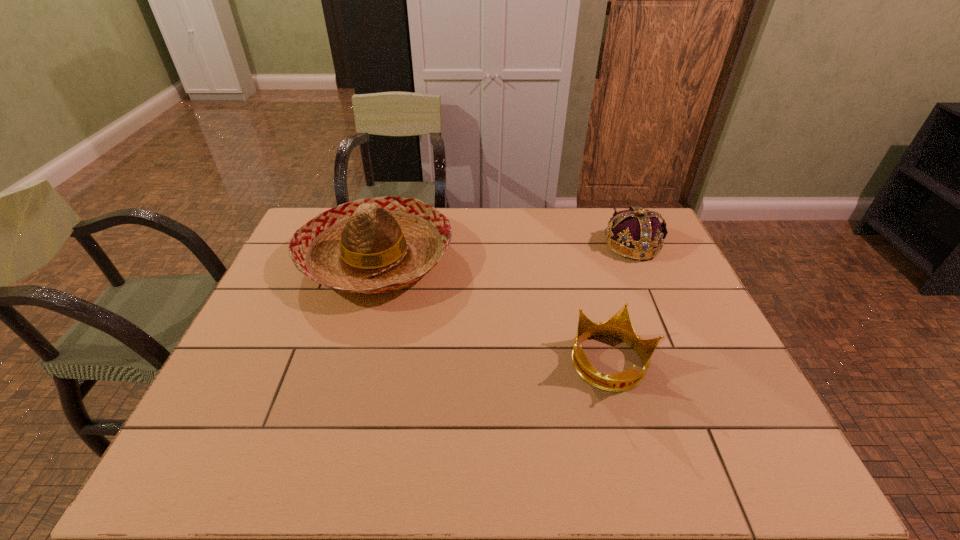
This screenshot has height=540, width=960. I want to click on object identified as the second closest to the tallest object, so (641, 236).

Identify which object is the closest to the nearest object. Please provide its 2D coordinates. Your answer should be formatted as a tuple, i.e. [(x, y)], where the tuple contains the x and y coordinates of a point satisfying the conditions above.

[(641, 236)]

The image size is (960, 540). I want to click on free space in the image that satisfies the following two spatial constraints: 1. on the front side of the leftmost object; 2. on the right side of the shorter crown, so click(x=347, y=363).

The image size is (960, 540). Find the location of `vacant space that satisfies the following two spatial constraints: 1. on the back side of the taller crown; 2. on the right side of the nearest object`. vacant space that satisfies the following two spatial constraints: 1. on the back side of the taller crown; 2. on the right side of the nearest object is located at coordinates (578, 245).

The height and width of the screenshot is (540, 960). Identify the location of vacant area in the image that satisfies the following two spatial constraints: 1. on the front side of the nearest object; 2. on the left side of the leftmost object. (347, 363).